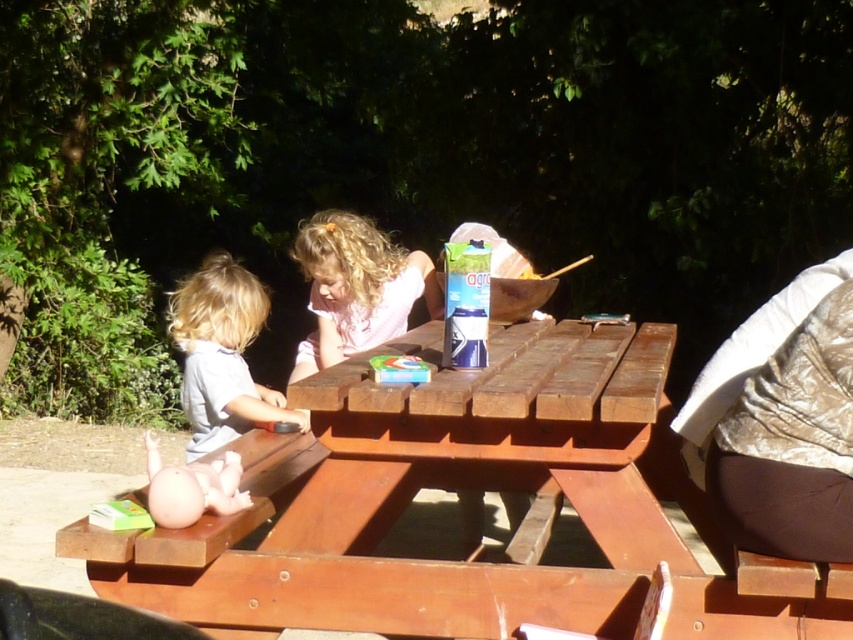
You are a photographer trying to capture a candid shot of the two children at the wooden picnic table. You want to ensure both the blonde hair girl at center and the smooth gray shirt at left are clearly visible. Given their spatial arrangement, which child should you focus on to ensure the entire scene is in focus?

The smooth gray shirt at left occupies more space in the scene than the blonde hair girl at center, so focusing on the smooth gray shirt at left would help ensure the entire scene remains in focus.